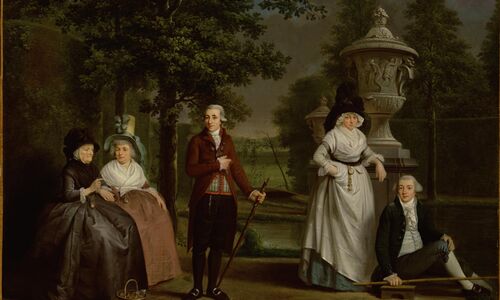
In order to click on statue bases in this screenshot , I will do `click(312, 169)`, `click(397, 161)`.